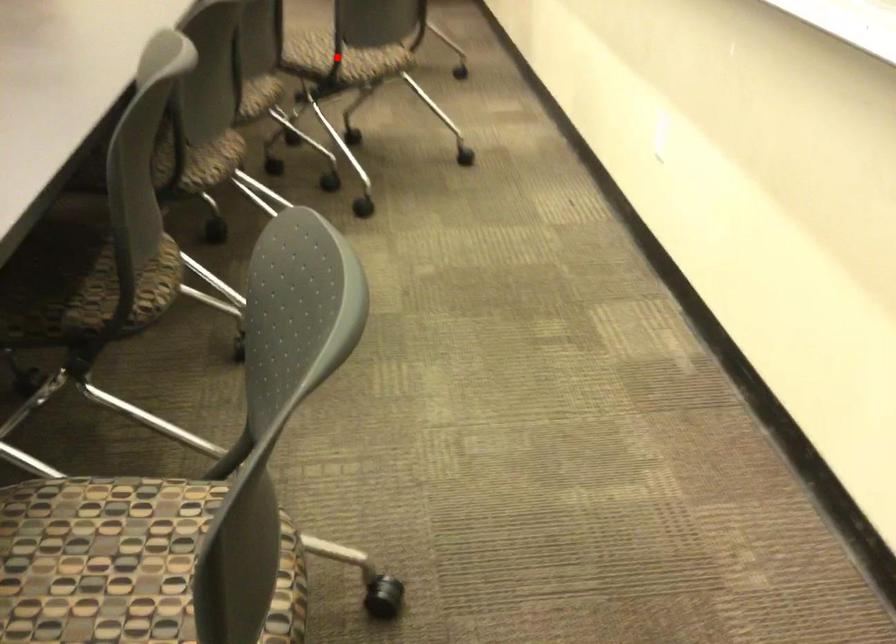
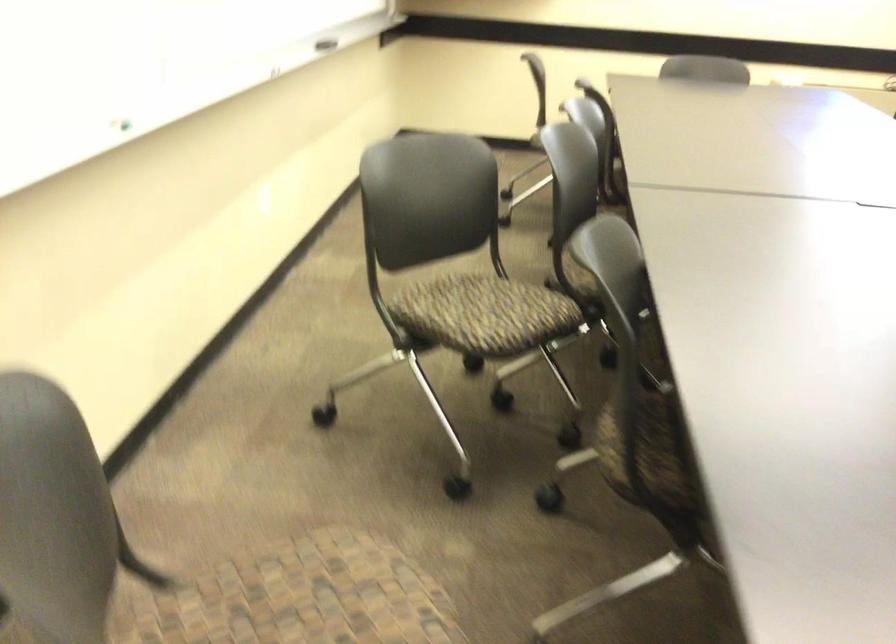
Question: I am providing you with two images of the same scene from different viewpoints. A red point is marked on the first image. Can you still see the location of the red point in image 2?

Choices:
 (A) Yes
 (B) No

Answer: (B)